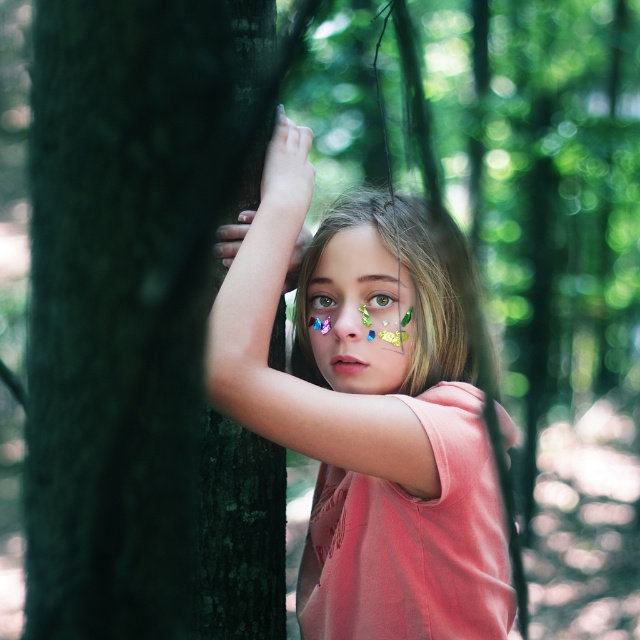
Question: Estimate the real-world distances between objects in this image. Which object is farther from the pink matte shirt at center?

Choices:
 (A) dark green bark at left
 (B) green iridescent eye at center
 (C) brown matte eye at center

Answer: (C)

Question: Is dark green bark at left smaller than pink matte shirt at center?

Choices:
 (A) yes
 (B) no

Answer: (A)

Question: Does shiny metallic face at center appear over brown matte eye at center?

Choices:
 (A) yes
 (B) no

Answer: (B)

Question: Is shiny metallic face at center behind brown matte eye at center?

Choices:
 (A) yes
 (B) no

Answer: (B)

Question: Which is farther from the shiny metallic face at center?

Choices:
 (A) dark green bark at left
 (B) pink matte shirt at center
 (C) green iridescent eye at center
 (D) brown matte eye at center

Answer: (A)

Question: Which of the following is the closest to the observer?

Choices:
 (A) dark green bark at left
 (B) green iridescent eye at center
 (C) brown matte eye at center
 (D) shiny metallic face at center

Answer: (A)